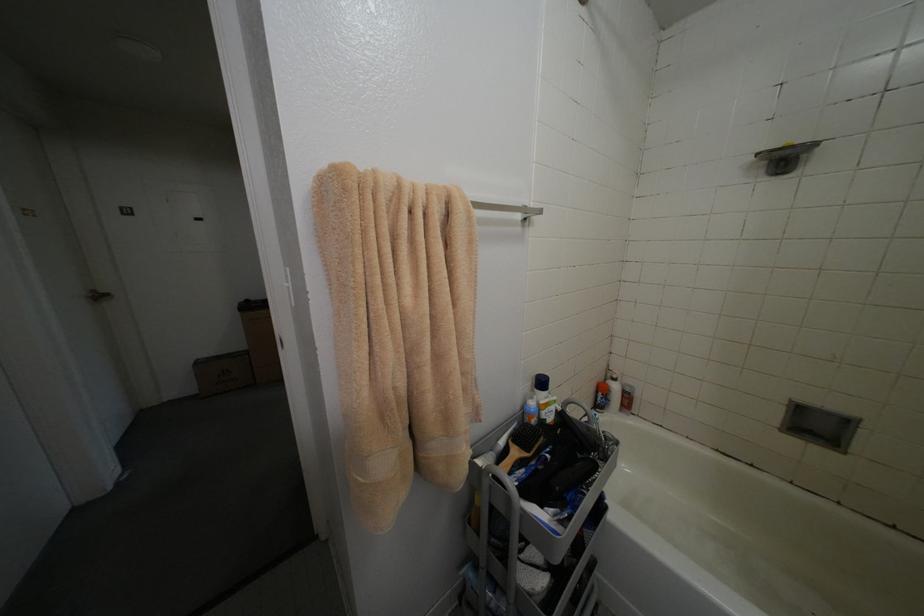
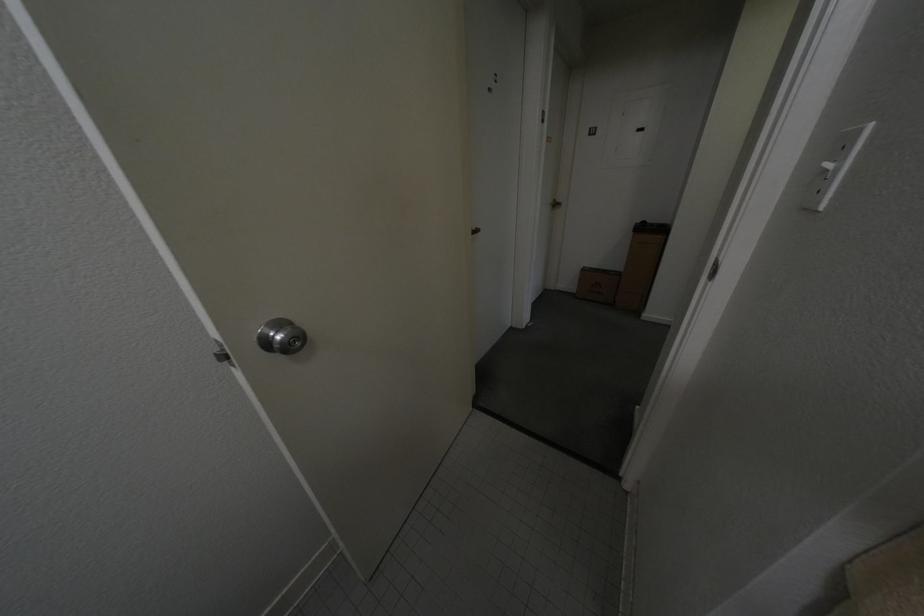
How did the camera likely rotate?

The rotation direction of the camera is left-down.